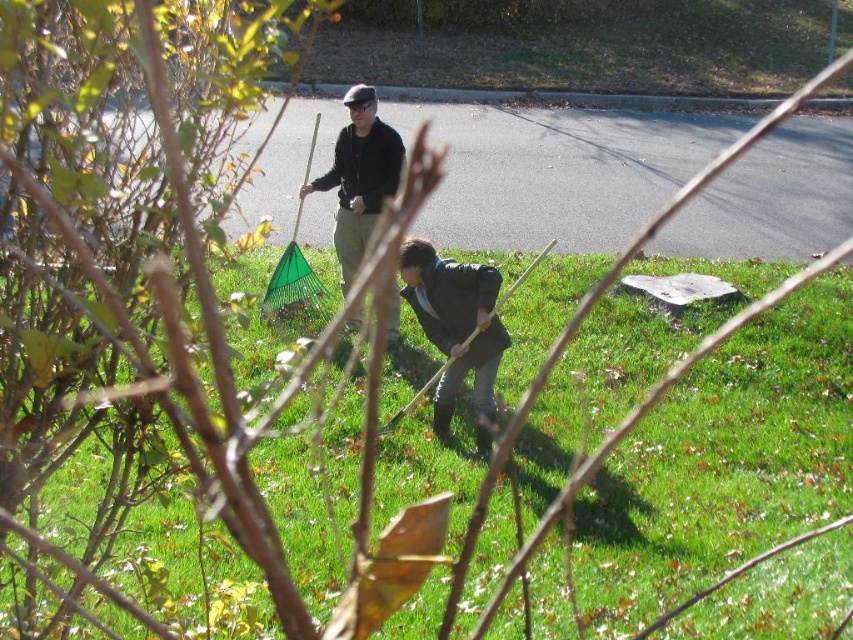
Between green grass at center and dark blue suit at lower center, which one appears on the left side from the viewer's perspective?

dark blue suit at lower center is more to the left.

Which of these two, green grass at center or dark blue suit at lower center, stands shorter?

dark blue suit at lower center is shorter.

Is point (740, 364) positioned in front of point (473, 291)?

That is False.

Where is `green grass at center`? green grass at center is located at coordinates (722, 465).

Who is positioned more to the left, green grass at center or matte black jacket at center?

matte black jacket at center

Can you confirm if green grass at center is positioned to the right of matte black jacket at center?

Indeed, green grass at center is positioned on the right side of matte black jacket at center.

In order to click on green grass at center in this screenshot , I will do `click(722, 465)`.

This screenshot has height=640, width=853. In order to click on green grass at center in this screenshot , I will do `click(722, 465)`.

Between dark blue suit at lower center and matte black jacket at center, which one appears on the left side from the viewer's perspective?

From the viewer's perspective, matte black jacket at center appears more on the left side.

Between dark blue suit at lower center and matte black jacket at center, which one has more height?

Standing taller between the two is matte black jacket at center.

The height and width of the screenshot is (640, 853). I want to click on dark blue suit at lower center, so click(x=456, y=328).